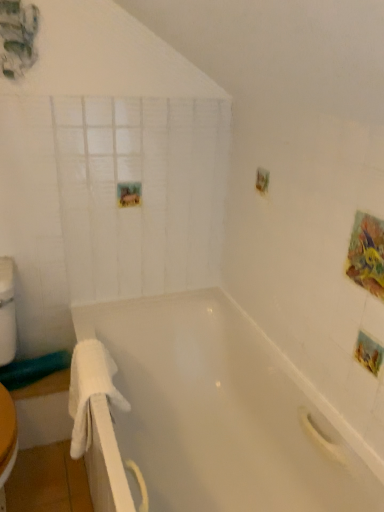
Question: From a real-world perspective, is white glossy bathtub at center physically located above or below white fluffy towel at left?

Choices:
 (A) below
 (B) above

Answer: (A)

Question: Is white glossy bathtub at center in front of or behind white fluffy towel at left in the image?

Choices:
 (A) front
 (B) behind

Answer: (A)

Question: Estimate the real-world distances between objects in this image. Which object is farther from the white fluffy towel at left?

Choices:
 (A) white glossy bathtub at center
 (B) white matte glass door at upper left

Answer: (B)

Question: Estimate the real-world distances between objects in this image. Which object is farther from the white fluffy towel at left?

Choices:
 (A) white glossy bathtub at center
 (B) white matte glass door at upper left

Answer: (B)